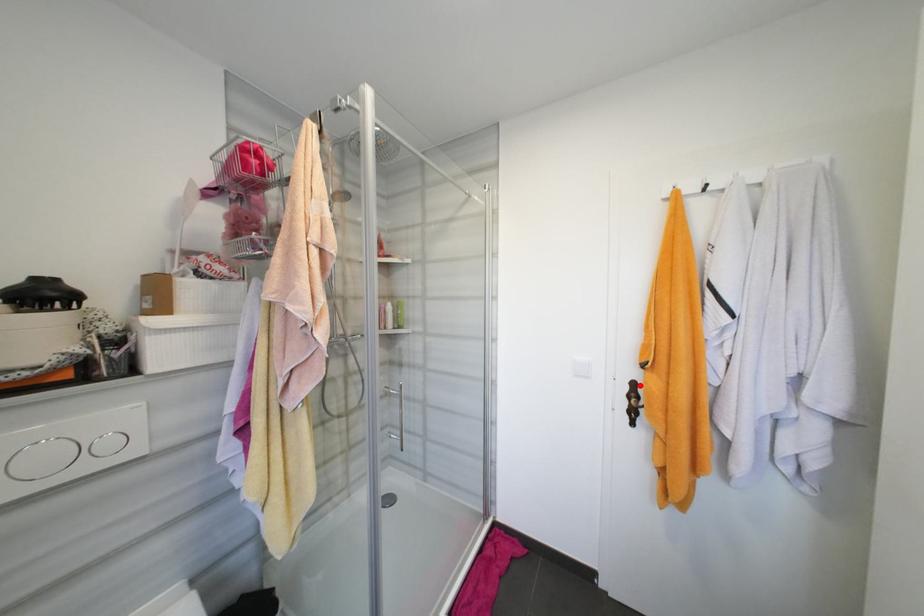
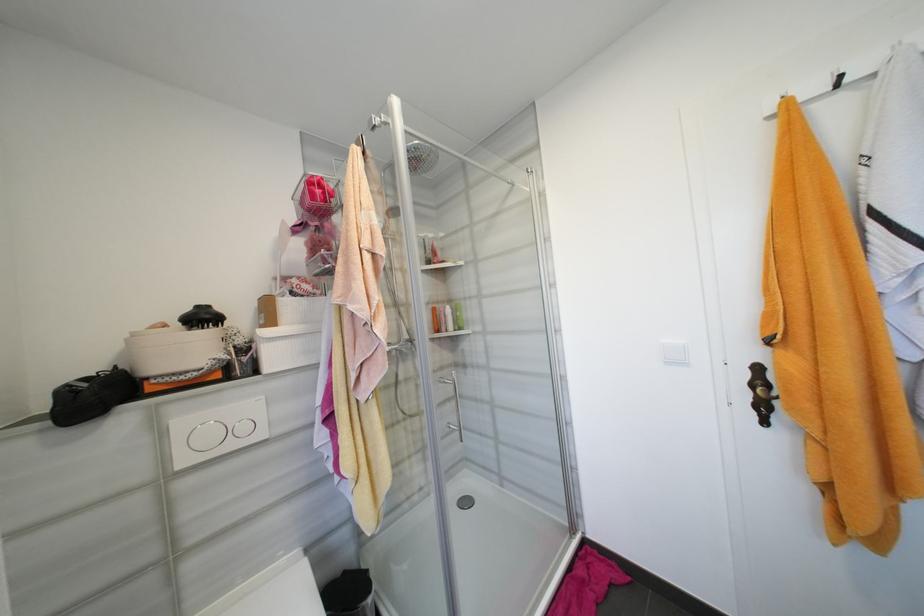
In the second image, find the point that corresponds to the highlighted location in the first image.

(763, 370)